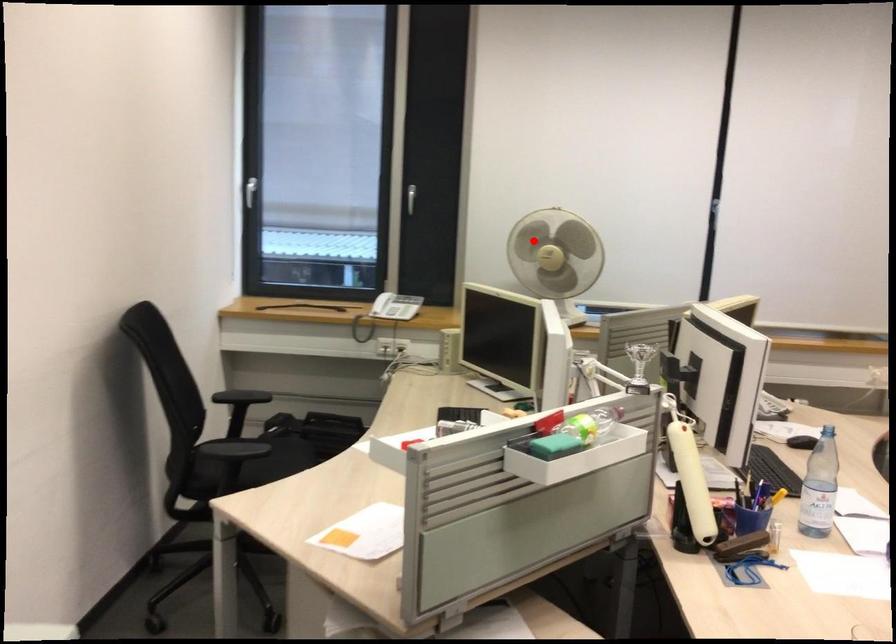
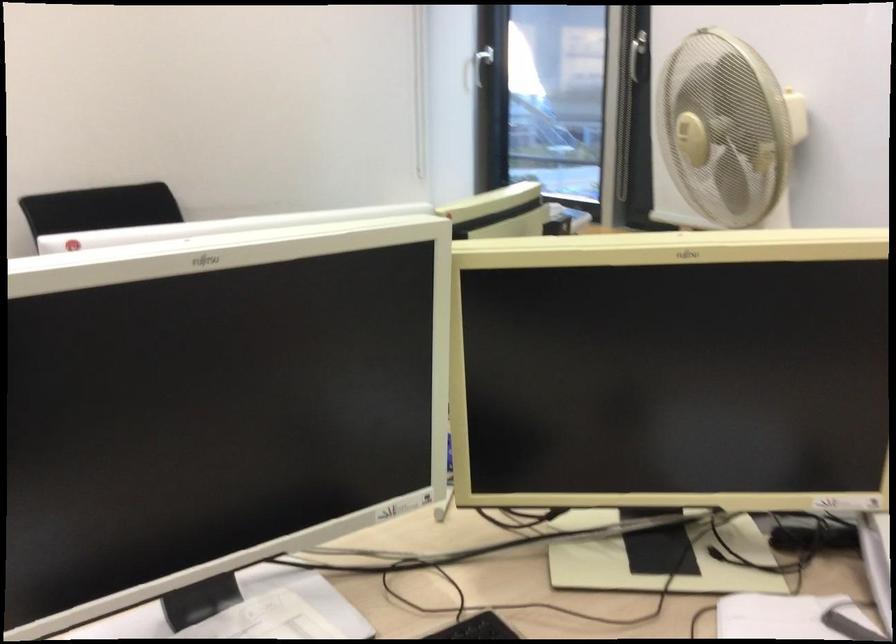
The point at the highlighted location is marked in the first image. Where is the corresponding point in the second image?

(685, 129)